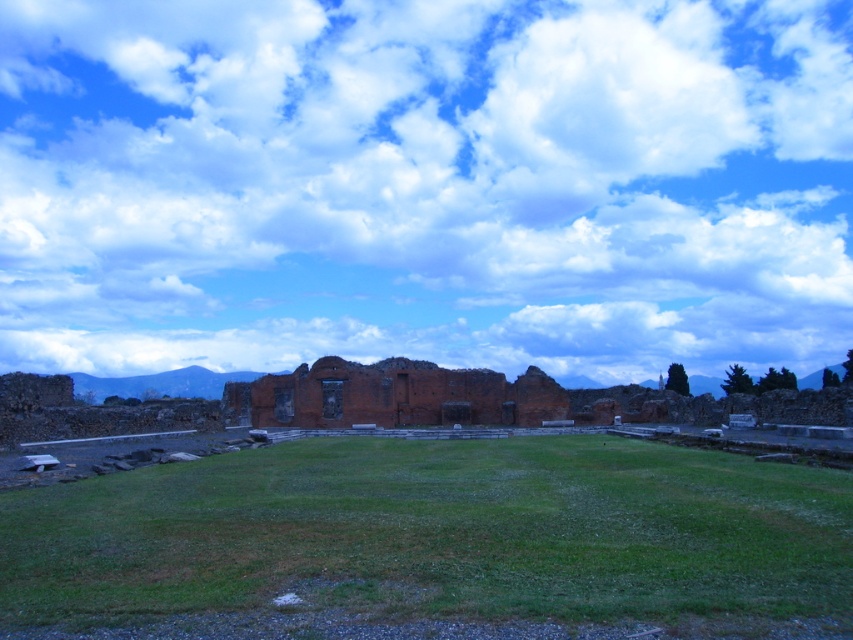
You are standing on the grassy area in the foreground and looking at the image. There is a point at coordinates (424, 184). What is this point part of?

The point at coordinates (424, 184) is part of the white fluffy cloud at upper center.